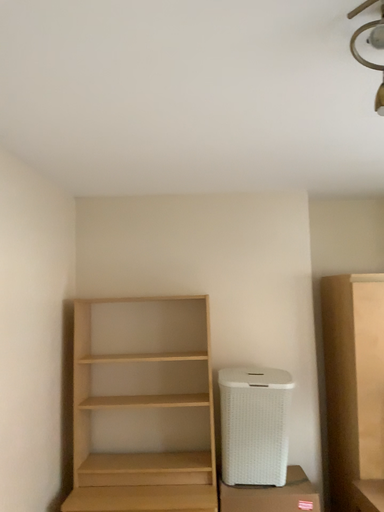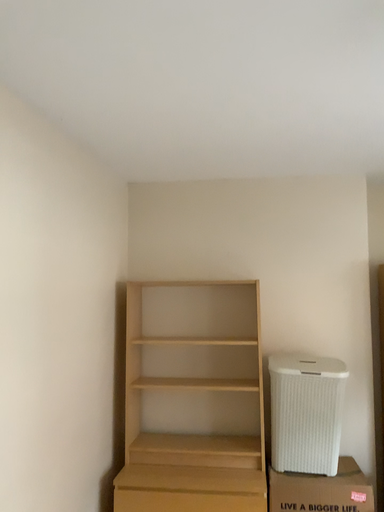
Question: Which way did the camera rotate in the video?

Choices:
 (A) rotated left
 (B) rotated right

Answer: (A)